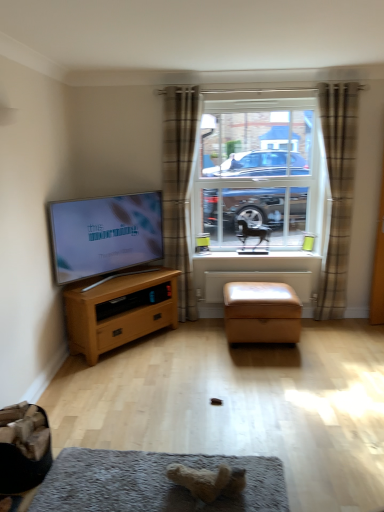
This screenshot has width=384, height=512. I want to click on free spot to the right of wooden chest of drawers at left, so click(195, 349).